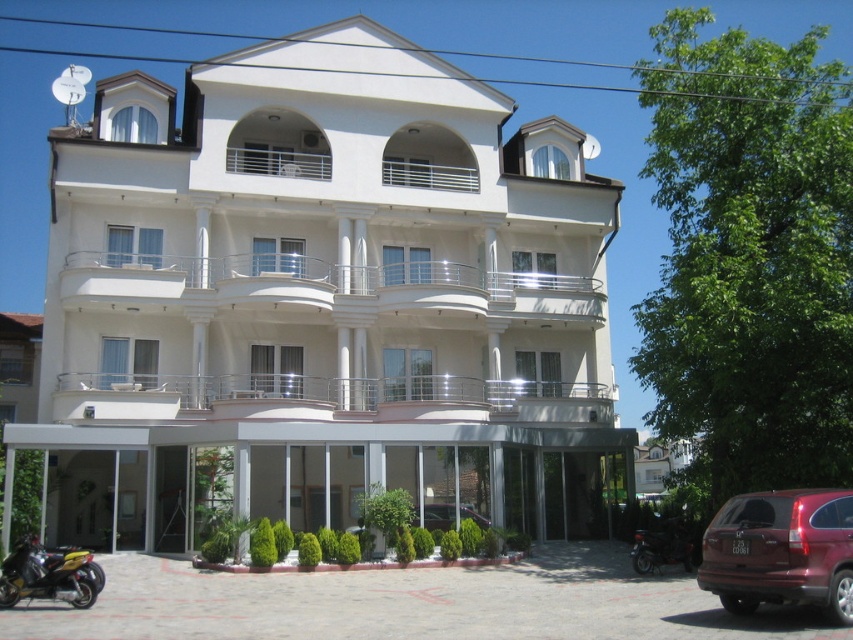
Question: Can you confirm if yellow matte motorbike at lower left is positioned below shiny black motorcycle at lower right?

Choices:
 (A) yes
 (B) no

Answer: (B)

Question: Is maroon matte suv at lower right bigger than yellow matte motorbike at lower left?

Choices:
 (A) no
 (B) yes

Answer: (B)

Question: Which point is closer to the camera taking this photo?

Choices:
 (A) (683, 516)
 (B) (397, 64)

Answer: (A)

Question: Which object is the farthest from the shiny black motorcycle at lower right?

Choices:
 (A) metallic silver car at center
 (B) yellow matte motorbike at lower left

Answer: (B)

Question: Estimate the real-world distances between objects in this image. Which object is farther from the maroon matte suv at lower right?

Choices:
 (A) metallic silver car at center
 (B) shiny black motorcycle at lower right

Answer: (A)

Question: In this image, where is white glossy building at center located relative to maroon matte suv at lower right?

Choices:
 (A) left
 (B) right

Answer: (A)